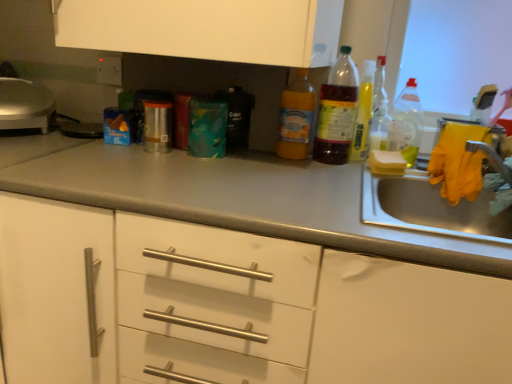
Question: Is translucent plastic bottle at right, the second bottle from the right, completely or partially outside of translucent plastic bottle at upper right, arranged as the third bottle when viewed from the right?

Choices:
 (A) yes
 (B) no

Answer: (A)

Question: Can you confirm if translucent plastic bottle at right, the fourth bottle positioned from the left, is taller than translucent plastic bottle at upper right, the third bottle in the left-to-right sequence?

Choices:
 (A) yes
 (B) no

Answer: (B)

Question: From a real-world perspective, is translucent plastic bottle at right, the second bottle from the right, under translucent plastic bottle at upper right, the third bottle in the left-to-right sequence?

Choices:
 (A) no
 (B) yes

Answer: (B)

Question: Is translucent plastic bottle at right, the second bottle from the right, bigger than translucent plastic bottle at upper right, the third bottle in the left-to-right sequence?

Choices:
 (A) no
 (B) yes

Answer: (A)

Question: Considering the relative positions of translucent plastic bottle at right, the fourth bottle positioned from the left, and translucent plastic bottle at upper right, arranged as the third bottle when viewed from the right, in the image provided, is translucent plastic bottle at right, the fourth bottle positioned from the left, behind translucent plastic bottle at upper right, arranged as the third bottle when viewed from the right,?

Choices:
 (A) yes
 (B) no

Answer: (A)

Question: From the image's perspective, is translucent plastic bottle at right, the second bottle from the right, located above translucent plastic bottle at upper right, arranged as the third bottle when viewed from the right?

Choices:
 (A) no
 (B) yes

Answer: (A)

Question: Considering the relative sizes of translucent plastic bottle at center, the 2th bottle in the left-to-right sequence, and translucent plastic bottle at right, which is the 5th bottle from left to right, in the image provided, is translucent plastic bottle at center, the 2th bottle in the left-to-right sequence, smaller than translucent plastic bottle at right, which is the 5th bottle from left to right,?

Choices:
 (A) yes
 (B) no

Answer: (A)

Question: Can you confirm if translucent plastic bottle at center, which ranks as the fourth bottle in right-to-left order, is bigger than translucent plastic bottle at right, positioned as the 1th bottle in right-to-left order?

Choices:
 (A) no
 (B) yes

Answer: (A)

Question: Is translucent plastic bottle at center, the 2th bottle in the left-to-right sequence, with translucent plastic bottle at right, which is the 5th bottle from left to right?

Choices:
 (A) no
 (B) yes

Answer: (A)

Question: Is translucent plastic bottle at center, the 2th bottle in the left-to-right sequence, not inside translucent plastic bottle at right, which is the 5th bottle from left to right?

Choices:
 (A) yes
 (B) no

Answer: (A)

Question: Is translucent plastic bottle at center, the 2th bottle in the left-to-right sequence, facing away from translucent plastic bottle at right, positioned as the 1th bottle in right-to-left order?

Choices:
 (A) yes
 (B) no

Answer: (B)

Question: Can you confirm if translucent plastic bottle at center, the 2th bottle in the left-to-right sequence, is wider than translucent plastic bottle at right, positioned as the 1th bottle in right-to-left order?

Choices:
 (A) yes
 (B) no

Answer: (B)

Question: Is gray matte countertop at center located within translucent plastic bottle at upper right, arranged as the third bottle when viewed from the right?

Choices:
 (A) no
 (B) yes

Answer: (A)